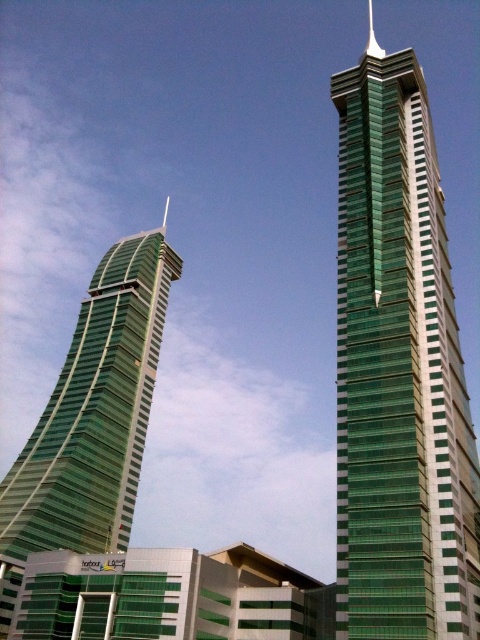
You are standing in front of two modern skyscrapers. You see the green glass tower at center and the green glass spire at upper center. Which one is positioned to the left of the other?

The green glass tower at center is positioned to the left of the green glass spire at upper center.

You are a drone operator who needs to fly a drone between the green glass tower at center and the green glass spire at upper center. The drone has a maximum flight distance of 100 feet. Can the drone safely fly between them without exceeding its range?

The distance between the green glass tower at center and the green glass spire at upper center is 120.96 feet, which exceeds the drone operator maximum flight distance of 100 feet. Therefore, the drone cannot safely fly between them without exceeding its range.